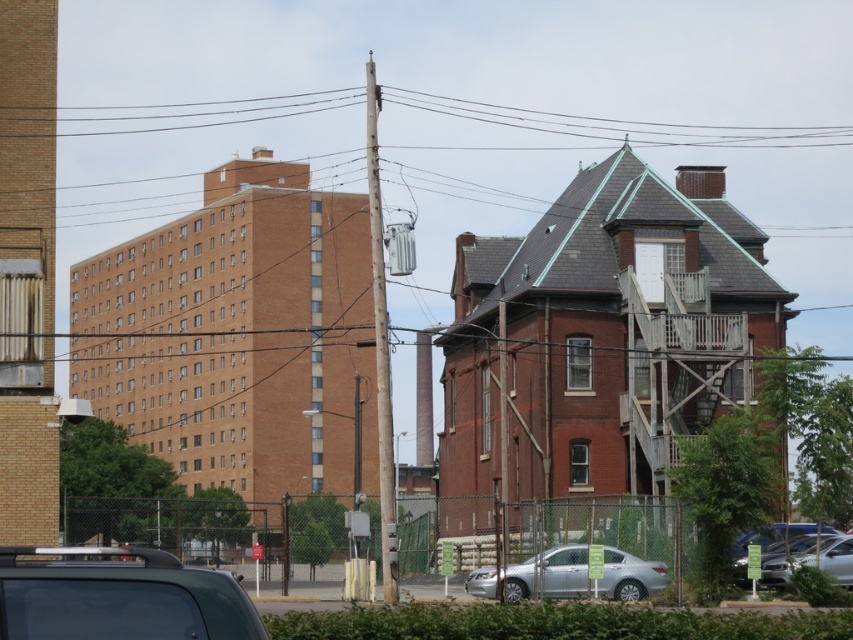
You are a pedestrian standing at the center of the image. You need to cross the street to reach the modern brick building on the left. Which car, the metallic gray car at lower left or the silver metallic car at lower right, is closer to your starting position?

The metallic gray car at lower left is closer to your starting position because it is positioned to the left of the silver metallic car at lower right, and you are standing at the center.

From the picture: You are a delivery driver needing to park your truck between the two cars. The metallic gray car at lower left and the silver metallic car at lower right are both in your way. Which car do you need to move first to create space for your truck?

You need to move the metallic gray car at lower left first because it is smaller than the silver metallic car at lower right, so moving it would free up more space for the truck.

You are a delivery person trying to deliver a package to the Victorian house. You have a cart that is 2 meters wide. There is a metallic wire at upper center and a silver metallic sedan at center in the way. Can your cart pass through the space between them?

The metallic wire at upper center is wider than the silver metallic sedan at center. Since the metallic wire at upper center is wider, the space between them is narrower than the sedan alone. Your cart is 2 meters wide, so you need to check if the narrowest point between them is wider than 2 meters. However, without exact measurements, it is uncertain. But since the wire is wider, it might create a narrower passage. It is safer to assume the space might be too narrow for the cart.